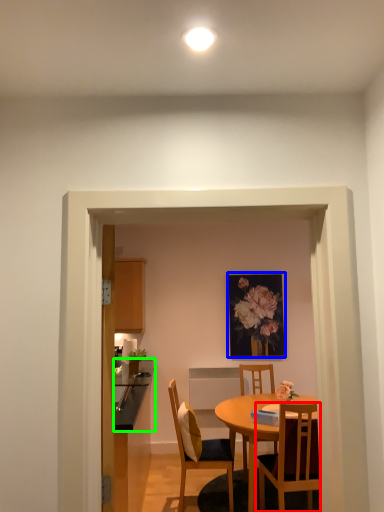
Question: Which object is positioned closest to chair (highlighted by a red box)? Select from picture frame (highlighted by a blue box) and counter top (highlighted by a green box).

Choices:
 (A) picture frame
 (B) counter top

Answer: (B)